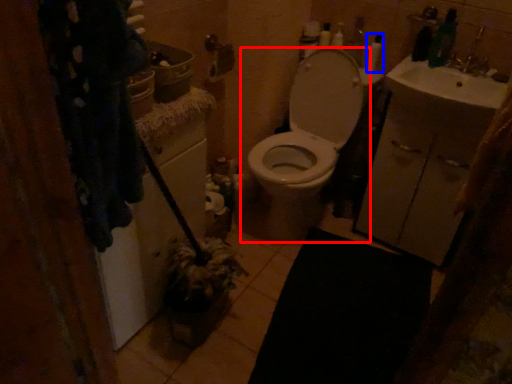
Question: Which object is further to the camera taking this photo, toilet (highlighted by a red box) or toiletry (highlighted by a blue box)?

Choices:
 (A) toilet
 (B) toiletry

Answer: (B)